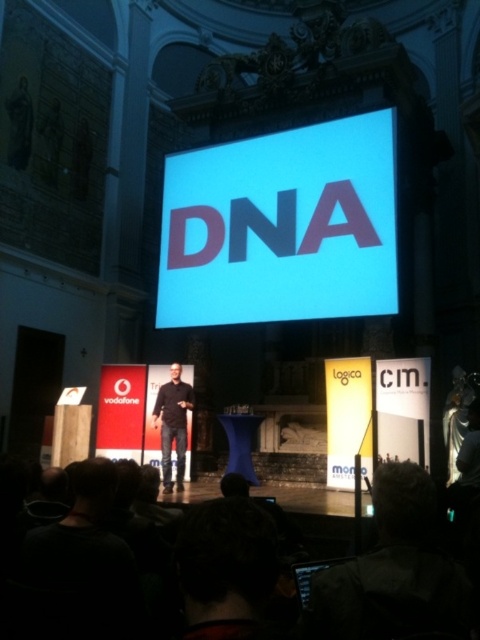
Question: Considering the relative positions of white glossy projection screen at center and dark brown leather jacket at lower center in the image provided, where is white glossy projection screen at center located with respect to dark brown leather jacket at lower center?

Choices:
 (A) left
 (B) right

Answer: (A)

Question: Which object appears closest to the camera in this image?

Choices:
 (A) dark brown leather jacket at lower center
 (B) black matte shirt at center
 (C) white glossy projection screen at center

Answer: (A)

Question: In this image, where is dark brown leather jacket at lower center located relative to black matte shirt at center?

Choices:
 (A) right
 (B) left

Answer: (A)

Question: Can you confirm if white glossy projection screen at center is positioned below dark brown leather jacket at lower center?

Choices:
 (A) no
 (B) yes

Answer: (A)

Question: Which point is farther from the camera taking this photo?

Choices:
 (A) (168, 429)
 (B) (421, 490)
 (C) (230, 304)

Answer: (C)

Question: Estimate the real-world distances between objects in this image. Which object is closer to the black matte shirt at center?

Choices:
 (A) white glossy projection screen at center
 (B) dark brown leather jacket at lower center

Answer: (A)